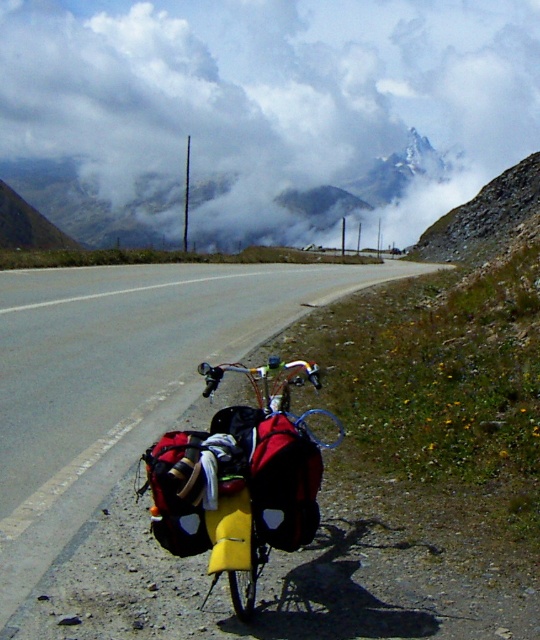
Question: Can you confirm if cloudy sky at upper center is positioned below yellow matte bag at center?

Choices:
 (A) yes
 (B) no

Answer: (B)

Question: Where is cloudy sky at upper center located in relation to yellow matte bag at center in the image?

Choices:
 (A) left
 (B) right

Answer: (A)

Question: Based on their relative distances, which object is farther from the cloudy sky at upper center?

Choices:
 (A) yellow matte bag at center
 (B) asphalt road at center

Answer: (A)

Question: Which point is closer to the camera taking this photo?

Choices:
 (A) (146, 241)
 (B) (113, 288)
 (C) (239, 509)

Answer: (C)

Question: Is cloudy sky at upper center to the right of yellow matte bag at center from the viewer's perspective?

Choices:
 (A) no
 (B) yes

Answer: (A)

Question: Which object is closer to the camera taking this photo?

Choices:
 (A) yellow matte bag at center
 (B) asphalt road at center

Answer: (A)